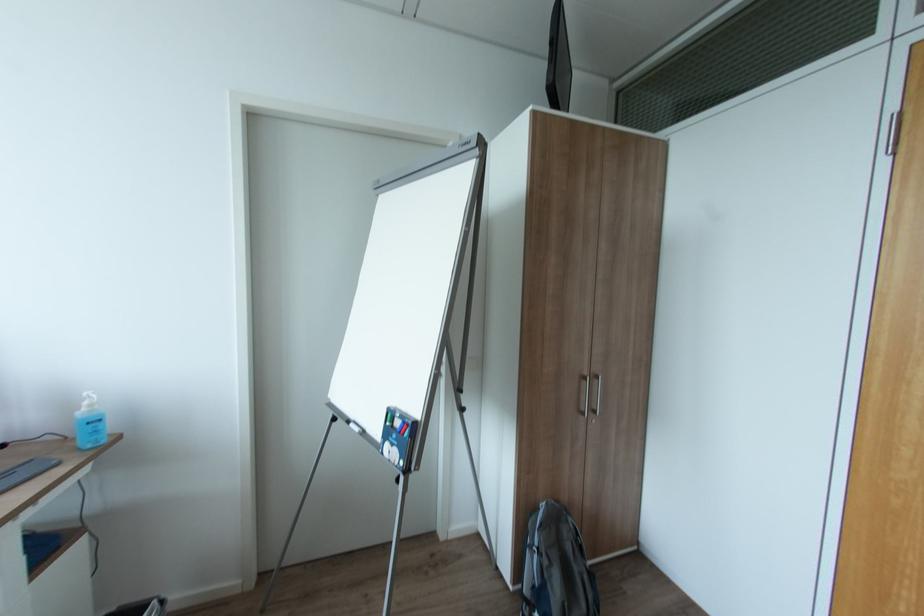
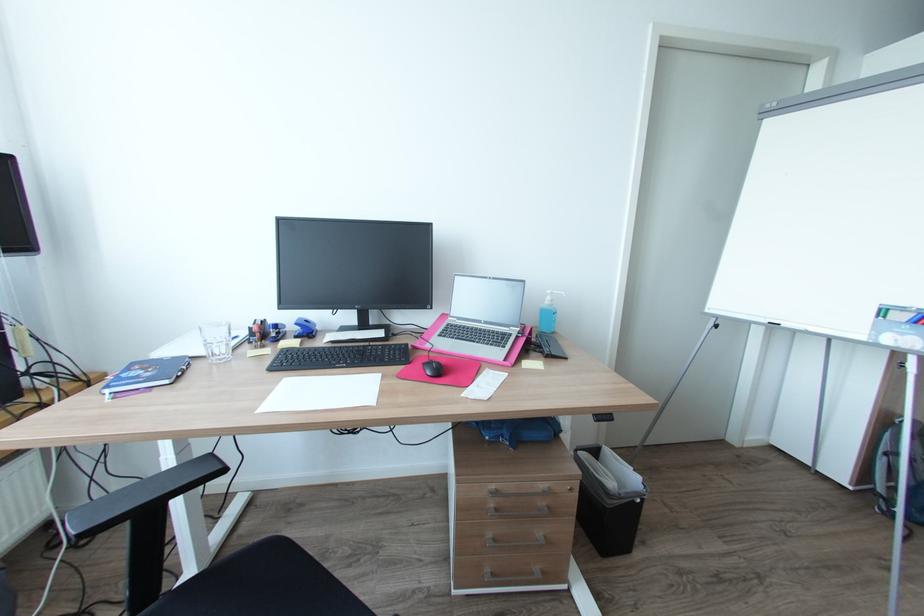
Question: What movement of the cameraman would produce the second image?

Choices:
 (A) Left
 (B) Right
 (C) Forward
 (D) Backward

Answer: (A)